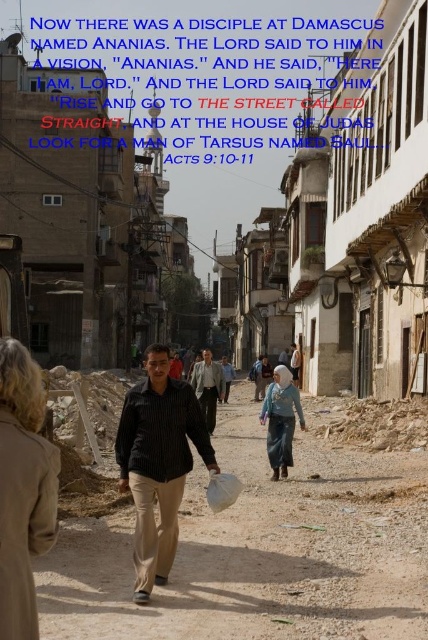
Is brown dirt road at center shorter than beige wool coat at center?

Indeed, brown dirt road at center has a lesser height compared to beige wool coat at center.

Is brown dirt road at center thinner than beige wool coat at center?

In fact, brown dirt road at center might be wider than beige wool coat at center.

Does point (95, 540) lie in front of point (5, 500)?

No.

Where is `brown dirt road at center`? brown dirt road at center is located at coordinates (261, 548).

Does black striped shirt at center have a smaller size compared to light brown striped shirt at center?

No.

Can you confirm if black striped shirt at center is positioned above light brown striped shirt at center?

Actually, black striped shirt at center is below light brown striped shirt at center.

Between point (145, 403) and point (208, 408), which one is positioned in front?

Point (145, 403) is in front.

Locate an element on the screen. black striped shirt at center is located at coordinates (157, 464).

Which of these two, brown dirt road at center or black striped shirt at center, stands taller?

With more height is black striped shirt at center.

How distant is brown dirt road at center from black striped shirt at center?

A distance of 4.36 meters exists between brown dirt road at center and black striped shirt at center.

Which is behind, point (62, 573) or point (199, 433)?

The point (199, 433) is behind.

This screenshot has width=428, height=640. In order to click on brown dirt road at center in this screenshot , I will do (x=261, y=548).